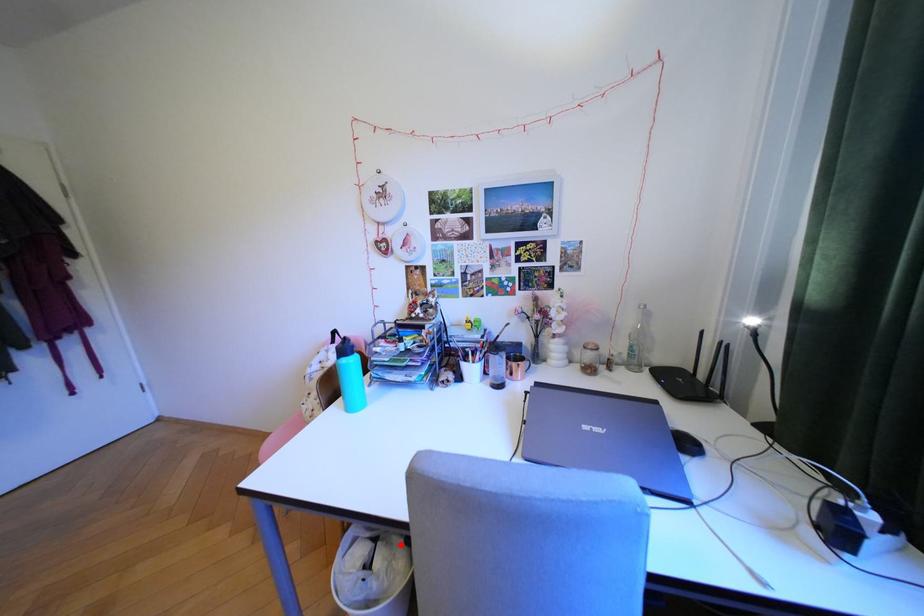
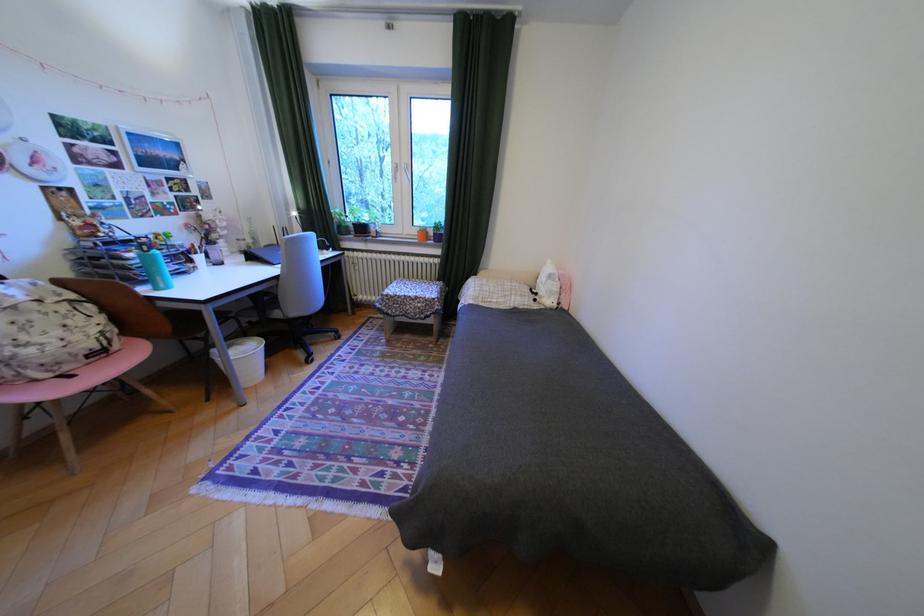
Where in the second image is the point corresponding to the highlighted location from the first image?

(249, 345)